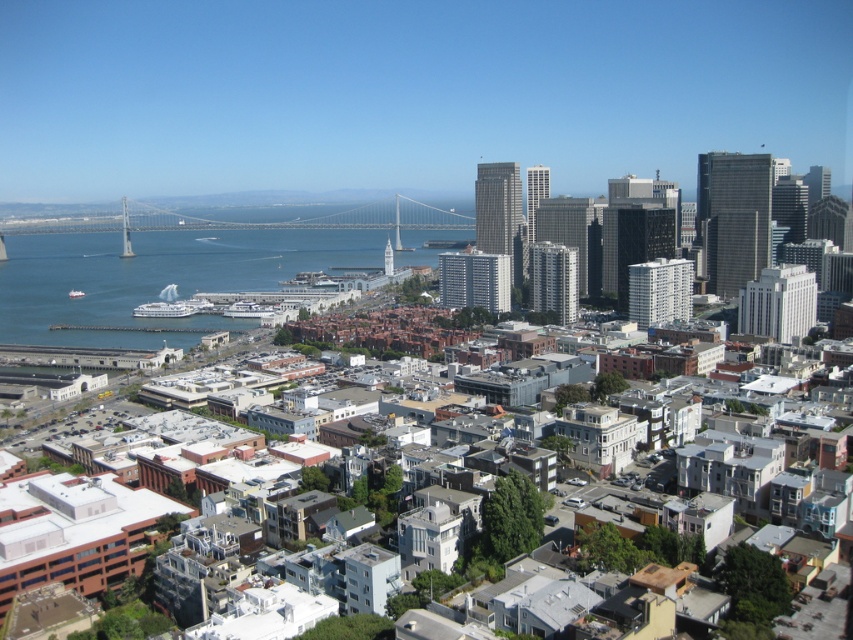
You are a photographer planning to capture a wide shot of the waterfront area. You need to ensure both the metallic gray bridge at center and the white glossy cruise ship at lower left are fully visible in the frame. Given their sizes, which object will require more horizontal space in the photo to avoid being cropped?

The metallic gray bridge at center requires more horizontal space in the photo because its width is larger than the white glossy cruise ship at lower left.